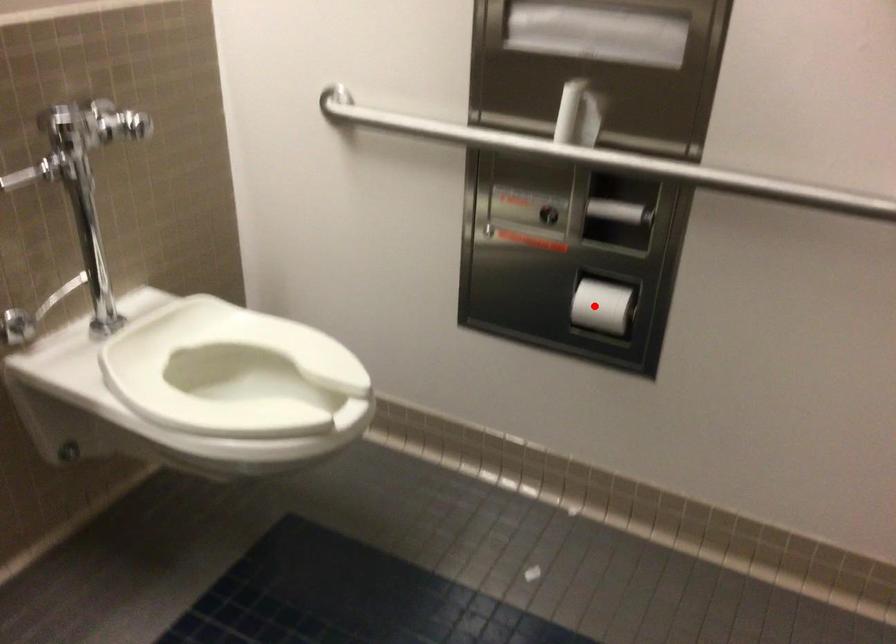
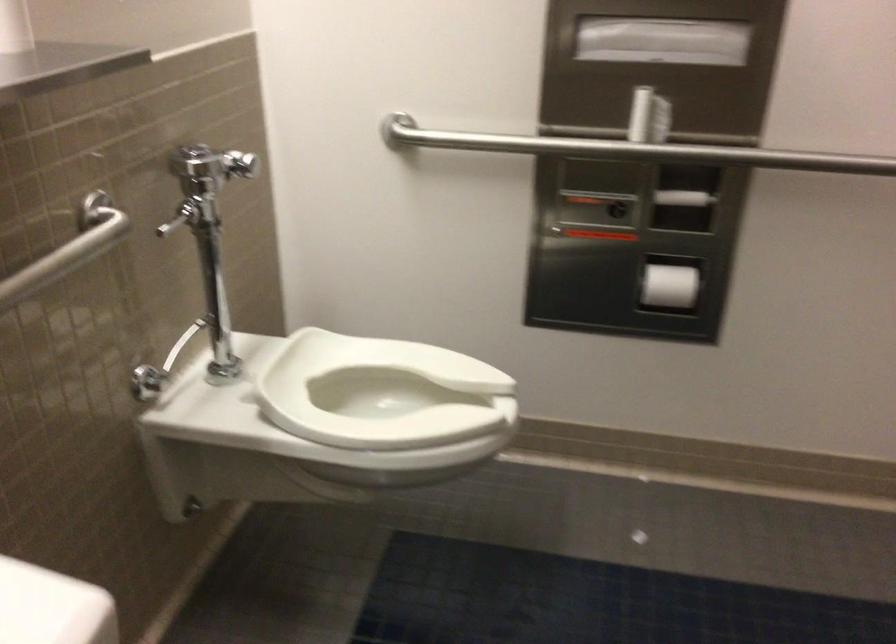
Question: I am providing you with two images of the same scene from different viewpoints. Given a red point in image1, look at the same physical point in image2. Is it:

Choices:
 (A) Closer to the viewpoint
 (B) Farther from the viewpoint

Answer: (B)